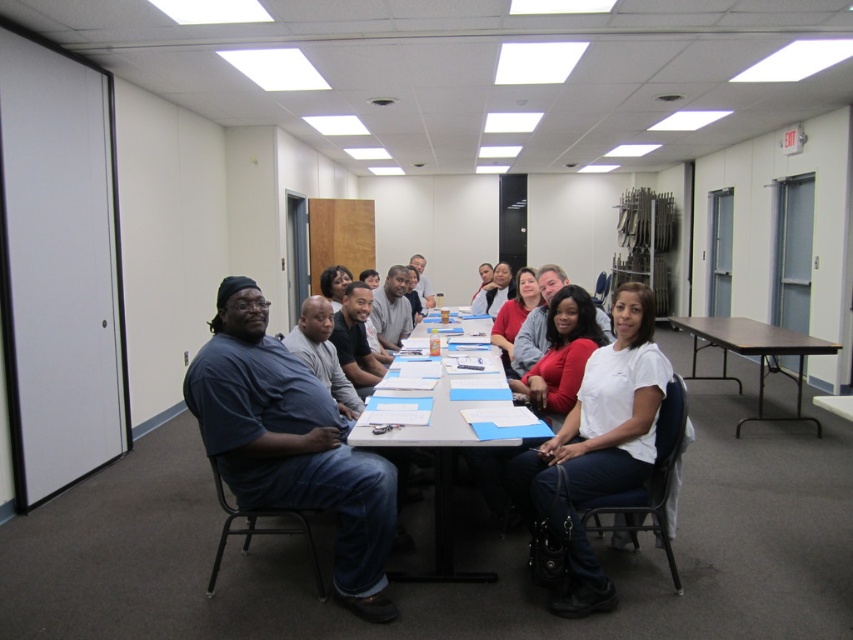
You are sitting at the white plastic table at center and want to hand a document to the person wearing the matte blue shirt at center. In which direction should you pass the document?

The matte blue shirt at center is to the left of the white plastic table at center, so you should pass the document to your left.

You are standing at the entrance of the conference room and see a point marked at coordinates (291,444). What object or person is located at that specific coordinate?

The point at coordinates (291,444) indicates the location of the dark blue shirt at center.

You are standing at the entrance of the conference room and see the point marked at coordinates (291, 444). What is located at that exact point?

The point at coordinates (291, 444) has a matte blue shirt at center located there.